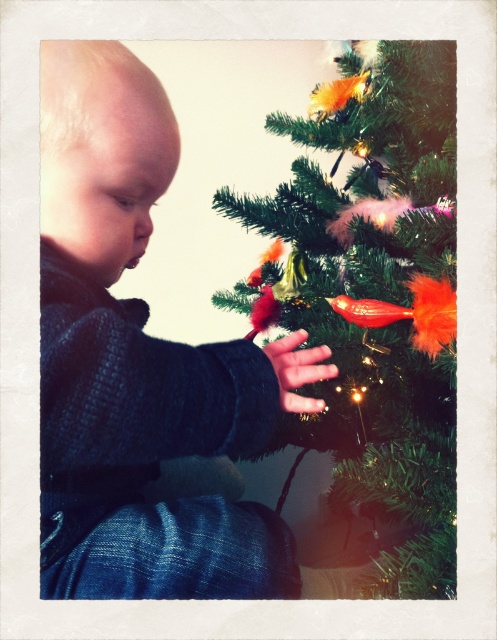
Who is taller, dark blue knitted sweater at left or green matte christmas tree at center?

green matte christmas tree at center

Who is positioned more to the left, dark blue knitted sweater at left or green matte christmas tree at center?

dark blue knitted sweater at left

Does point (263, 554) come closer to viewer compared to point (369, 264)?

Yes, it is.

This screenshot has height=640, width=497. Find the location of `dark blue knitted sweater at left`. dark blue knitted sweater at left is located at coordinates (139, 364).